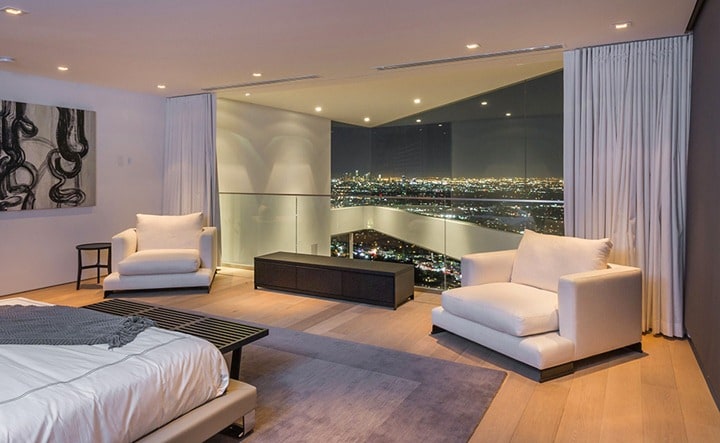
The width and height of the screenshot is (720, 443). Find the location of `table`. table is located at coordinates (238, 323).